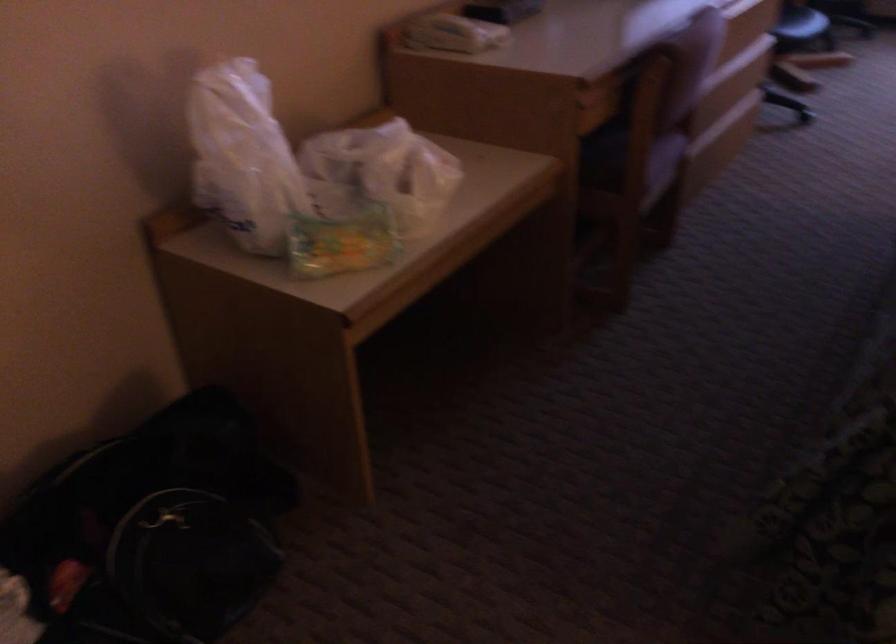
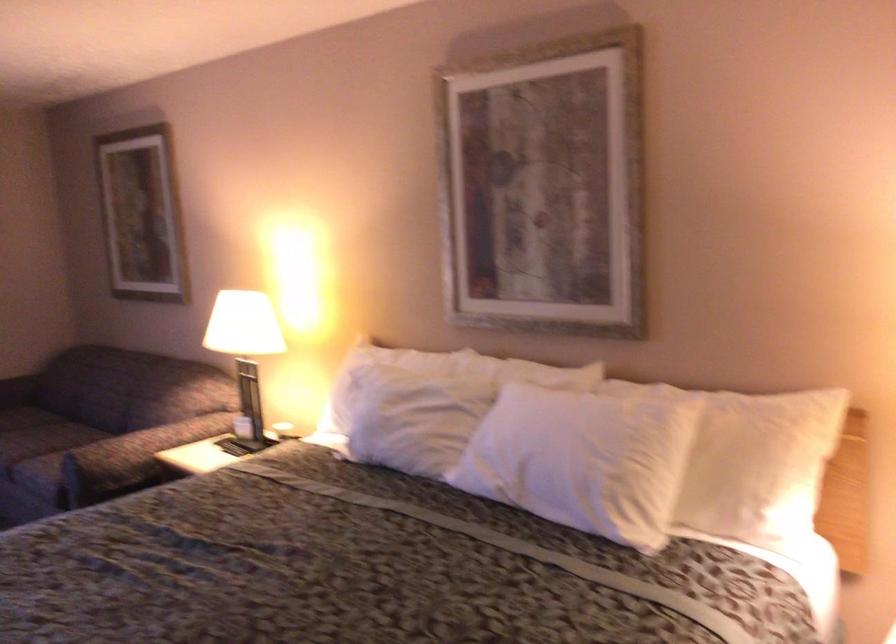
Question: The camera is either moving clockwise (left) or counter-clockwise (right) around the object. The first image is from the beginning of the video and the second image is from the end. Is the camera moving left or right when shooting the video?

Choices:
 (A) Left
 (B) Right

Answer: (A)